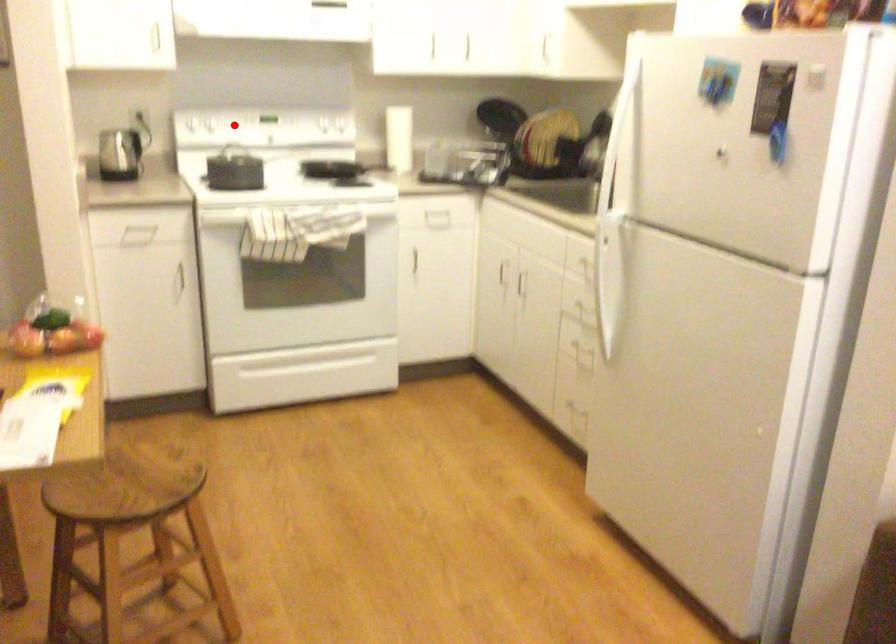
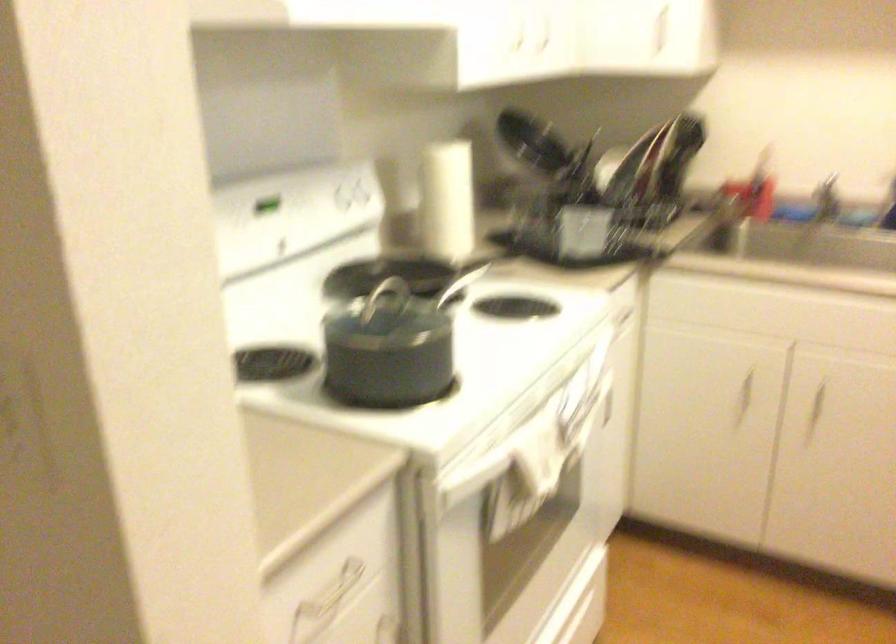
Question: I am providing you with two images of the same scene from different viewpoints. A red point is marked on the first image. Can you still see the location of the red point in image 2?

Choices:
 (A) Yes
 (B) No

Answer: (B)